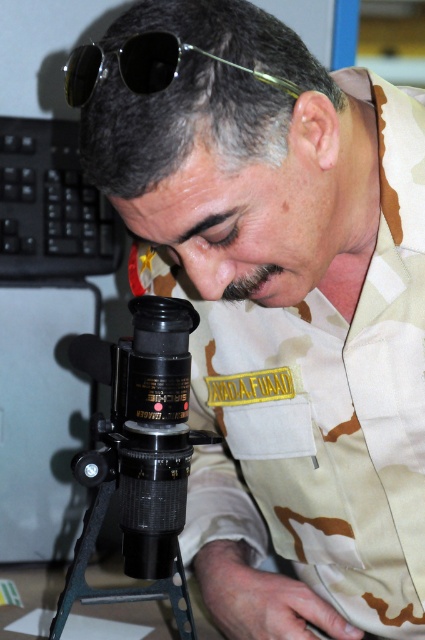
Question: Is black plastic camera at center positioned in front of black shiny sunglasses at upper center?

Choices:
 (A) yes
 (B) no

Answer: (B)

Question: Which of the following is the farthest from the observer?

Choices:
 (A) black matte tripod at center
 (B) black plastic camera at center
 (C) black shiny sunglasses at upper center

Answer: (A)

Question: Observing the image, what is the correct spatial positioning of black shiny sunglasses at upper center in reference to black matte tripod at center?

Choices:
 (A) below
 (B) above

Answer: (B)

Question: Does black plastic camera at center have a greater width compared to black shiny sunglasses at upper center?

Choices:
 (A) no
 (B) yes

Answer: (A)

Question: Which point is closer to the camera taking this photo?

Choices:
 (A) (99, 516)
 (B) (158, 296)
 (C) (150, 58)

Answer: (C)

Question: Among these objects, which one is nearest to the camera?

Choices:
 (A) black plastic camera at center
 (B) black shiny sunglasses at upper center

Answer: (B)